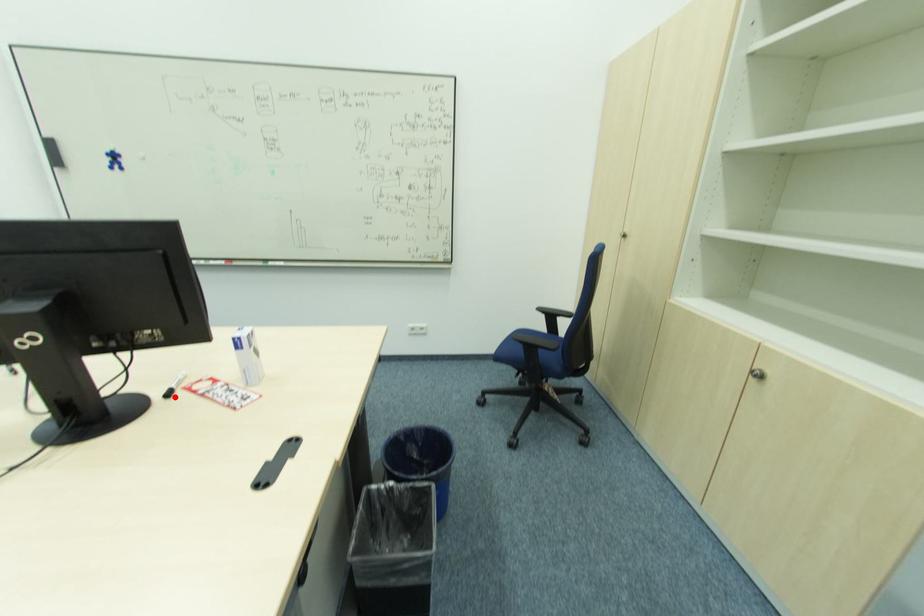
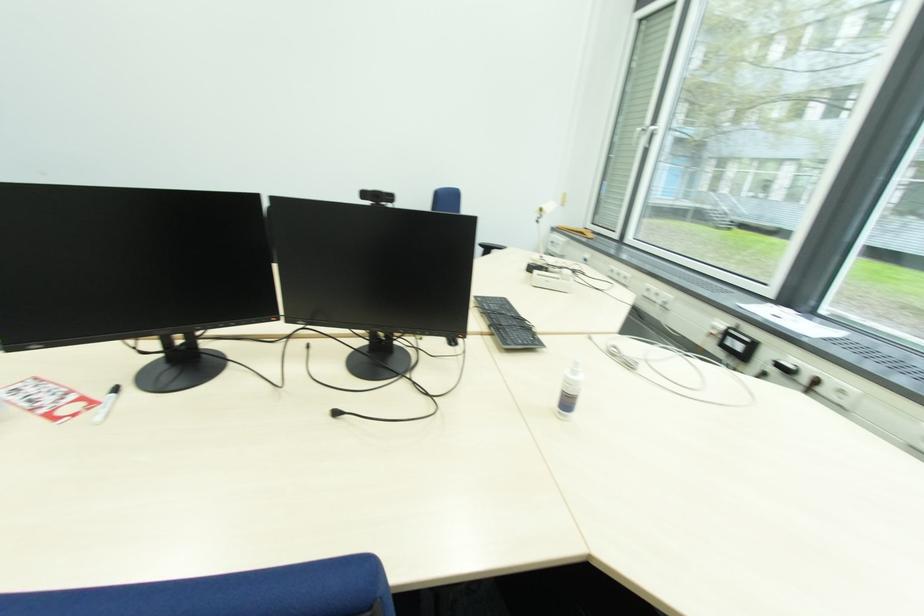
In the second image, find the point that corresponds to the highlighted location in the first image.

(118, 392)